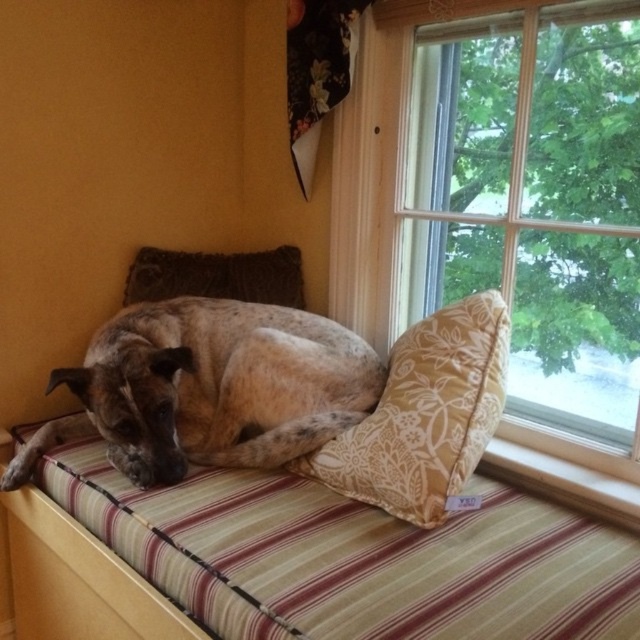
You are a dog owner who wants to place a new toy between the striped fabric dog bed at center and the floral fabric pillow at center. Based on their positions, where should you place the toy to ensure it is between them?

The striped fabric dog bed at center is located below the floral fabric pillow at center. To place the toy between them, you should position it in the space between the lower striped dog bed and the upper floral pillow at center.

You are standing in the room and want to place a small plant between the two points, point (8,476) and point (321,480). Since you want the plant to be closer to the front of the room, which point should you place it near?

You should place the plant near point (321,480) because point (8,476) is behind it, making point (321,480) the closer one to the front of the room.

You are standing in front of the window seat where the dog is resting. You want to place a small plant exactly at point (600, 474). Considering your height is 1.6 meters, will you be able to reach that point comfortably?

The distance of point (600, 474) from the viewer is 1.37 meters. Since the point is 1.37 meters away and your height is 1.6 meters, you can comfortably reach it by stretching forward slightly.